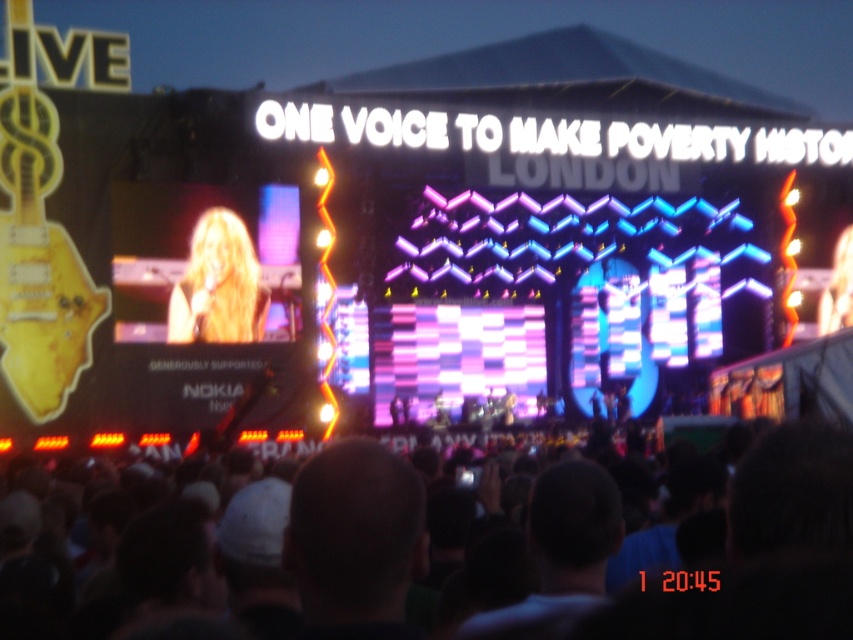
You are a photographer at the concert and want to capture both the dark hair at center and the blonde hair at center in a single frame. Which subject should you focus on first to ensure both are in the frame?

You should focus on the dark hair at center first since it is bigger than the blonde hair at center, ensuring it fits within the frame while still capturing the smaller blonde hair at center.

You are a photographer at the concert and want to capture the performer with long blonde hair on the left side of the stage. You notice a point at coordinates (x=257, y=561). Where is this point located in relation to the performer with long blonde hair?

The point at (x=257, y=561) is located on the dark hair at center, which is part of the performer with long blonde hair on the left side of the stage.

You are a photographer at the concert and want to capture both the blonde hair at left and the blonde hair at center in a single shot. Which one should you focus on to ensure the larger one is in frame first?

The blonde hair at left is larger in size compared to the blonde hair at center. To ensure the larger one is in frame first, focus on the blonde hair at left.